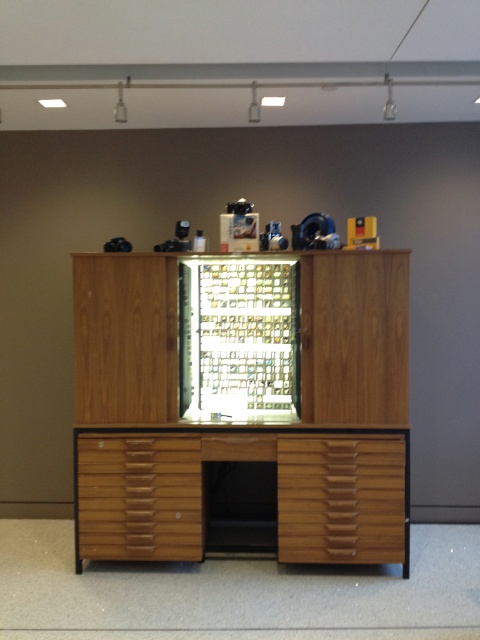
What do you see at coordinates (239, 339) in the screenshot? Image resolution: width=480 pixels, height=640 pixels. I see `metallic grid at center` at bounding box center [239, 339].

Can you confirm if metallic grid at center is wider than wooden drawer at center?

No.

Image resolution: width=480 pixels, height=640 pixels. What do you see at coordinates (239, 339) in the screenshot?
I see `metallic grid at center` at bounding box center [239, 339].

Locate an element on the screen. The height and width of the screenshot is (640, 480). metallic grid at center is located at coordinates (239, 339).

Which of these two, wooden file cabinet at center or wooden drawer at center, stands taller?

wooden file cabinet at center is taller.

Is wooden file cabinet at center wider than wooden drawer at center?

Correct, the width of wooden file cabinet at center exceeds that of wooden drawer at center.

Is point (307, 438) closer to camera compared to point (336, 445)?

No, it is not.

Where is `wooden file cabinet at center`? Image resolution: width=480 pixels, height=640 pixels. wooden file cabinet at center is located at coordinates (241, 401).

Which is below, wooden drawer at center or wooden drawer at lower center?

wooden drawer at lower center is lower down.

Who is positioned more to the left, wooden drawer at center or wooden drawer at lower center?

wooden drawer at lower center

The width and height of the screenshot is (480, 640). What are the coordinates of `wooden drawer at center` in the screenshot? It's located at (340, 499).